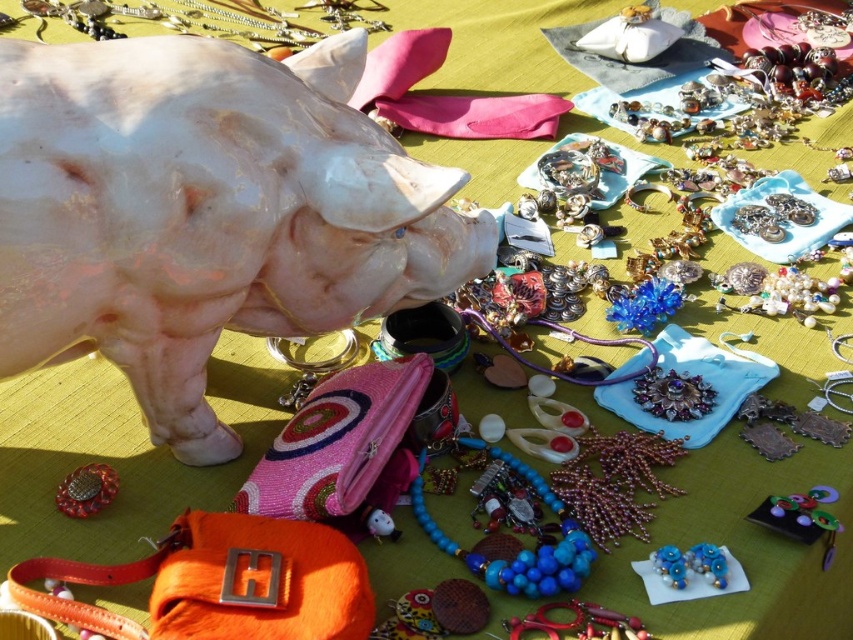
You are a customer at the market and want to choose between the blue beaded necklace at center and the blue beaded earrings at lower right. Which item is wider?

The blue beaded necklace at center is wider than the blue beaded earrings at lower right.

You are a customer at the market and want to pick up the blue beaded necklace at center. If you are standing 6 feet away from the table, can you reach the necklace without moving closer?

The blue beaded necklace at center is 5.57 feet away from the camera, so yes, you can reach it without moving closer since you are standing 6 feet away from the table.

In the scene shown: You are a customer at the market and want to place a new necklace exactly where the white glossy pig at upper left is currently located. Is this possible without moving the pig?

The white glossy pig at upper left is located at position coordinates point (x=206, y=212). Since the pig is occupying that space, you cannot place the necklace there without moving the pig.